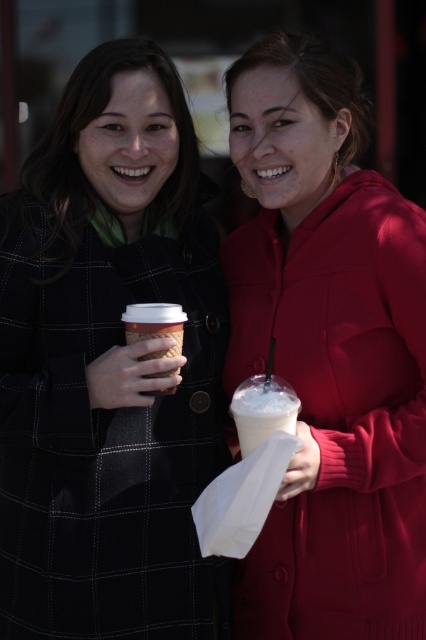
You are a photographer trying to capture a clear shot of the white frothy drink at center without the matte red hoodie at right blocking it. Based on their positions, is this possible?

The white frothy drink at center is behind the matte red hoodie at right, so it is currently blocked by the hoodie and cannot be captured clearly without moving either the drink or the hoodie.

You are a photographer adjusting your camera settings to capture the scene. You notice the matte black coat at left and the white paper cup at center. Which object should you focus on first if you want to ensure both are in sharp focus, considering their heights?

The matte black coat at left is taller than the white paper cup at center, so focusing on the taller object first would help ensure both are in sharp focus.